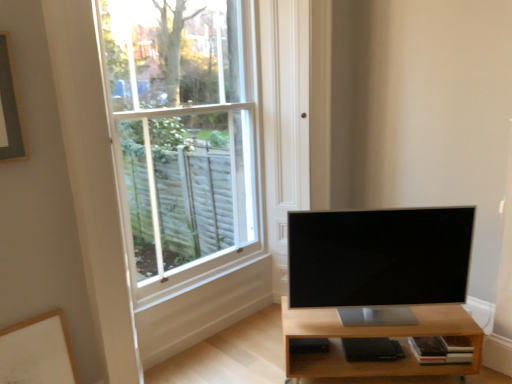
Question: From the image's perspective, is light brown wood shelf at lower right positioned above or below white matte picture frame at lower left?

Choices:
 (A) below
 (B) above

Answer: (A)

Question: In the image, is light brown wood shelf at lower right positioned in front of or behind white matte picture frame at lower left?

Choices:
 (A) front
 (B) behind

Answer: (B)

Question: Considering the real-world distances, which object is farthest from the white glass window at upper left?

Choices:
 (A) light brown wood shelf at lower right
 (B) satin black tv at center
 (C) white matte picture frame at lower left

Answer: (A)

Question: Estimate the real-world distances between objects in this image. Which object is farther from the white matte picture frame at lower left?

Choices:
 (A) light brown wood shelf at lower right
 (B) satin black tv at center
 (C) white glass window at upper left

Answer: (B)